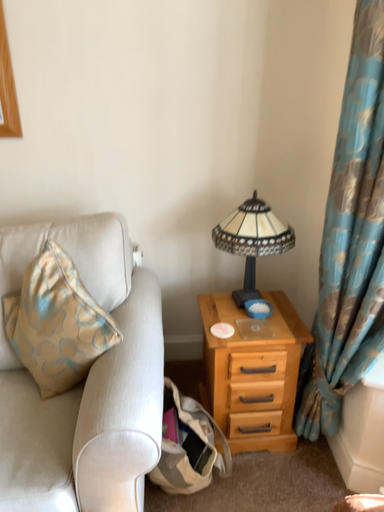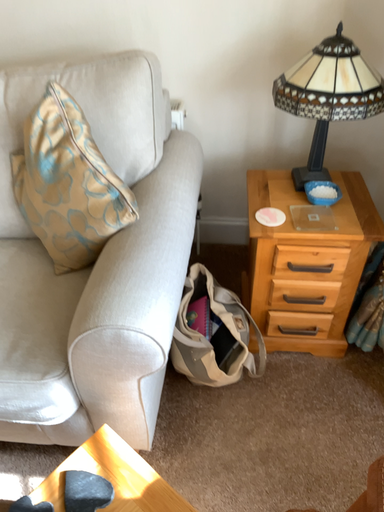
Question: How did the camera likely rotate when shooting the video?

Choices:
 (A) rotated downward
 (B) rotated upward

Answer: (A)